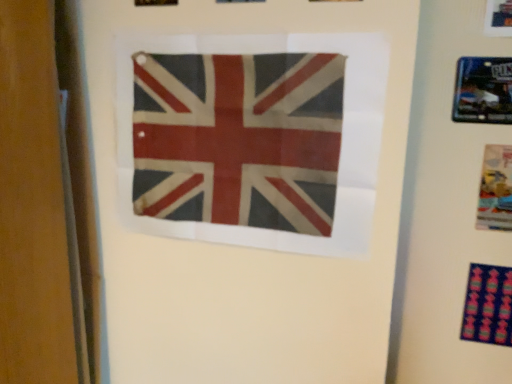
Question: Is matte plastic poster at right far away from worn fabric flag at center?

Choices:
 (A) yes
 (B) no

Answer: (B)

Question: Is matte plastic poster at right positioned behind worn fabric flag at center?

Choices:
 (A) no
 (B) yes

Answer: (B)

Question: Considering the relative sizes of matte plastic poster at right and worn fabric flag at center in the image provided, is matte plastic poster at right bigger than worn fabric flag at center?

Choices:
 (A) yes
 (B) no

Answer: (B)

Question: Considering the relative sizes of matte plastic poster at right and worn fabric flag at center in the image provided, is matte plastic poster at right smaller than worn fabric flag at center?

Choices:
 (A) no
 (B) yes

Answer: (B)

Question: Is matte plastic poster at right aimed at worn fabric flag at center?

Choices:
 (A) no
 (B) yes

Answer: (A)

Question: Does matte plastic poster at right appear on the right side of worn fabric flag at center?

Choices:
 (A) no
 (B) yes

Answer: (B)

Question: From the image's perspective, is worn fabric flag at center located beneath multicolored fabric at lower right?

Choices:
 (A) no
 (B) yes

Answer: (A)

Question: Could you tell me if worn fabric flag at center is facing multicolored fabric at lower right?

Choices:
 (A) no
 (B) yes

Answer: (A)

Question: Is worn fabric flag at center looking in the opposite direction of multicolored fabric at lower right?

Choices:
 (A) no
 (B) yes

Answer: (A)

Question: Can you confirm if worn fabric flag at center is wider than multicolored fabric at lower right?

Choices:
 (A) no
 (B) yes

Answer: (A)

Question: From a real-world perspective, is worn fabric flag at center located beneath multicolored fabric at lower right?

Choices:
 (A) yes
 (B) no

Answer: (B)

Question: Would you say worn fabric flag at center contains multicolored fabric at lower right?

Choices:
 (A) no
 (B) yes

Answer: (A)

Question: From the image's perspective, is metallic blue picture frame at upper right on multicolored fabric at lower right?

Choices:
 (A) yes
 (B) no

Answer: (A)